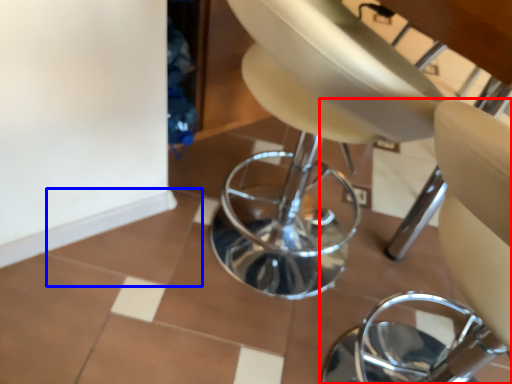
Question: Among these objects, which one is farthest to the camera, chair (highlighted by a red box) or ceramic tile (highlighted by a blue box)?

Choices:
 (A) chair
 (B) ceramic tile

Answer: (B)